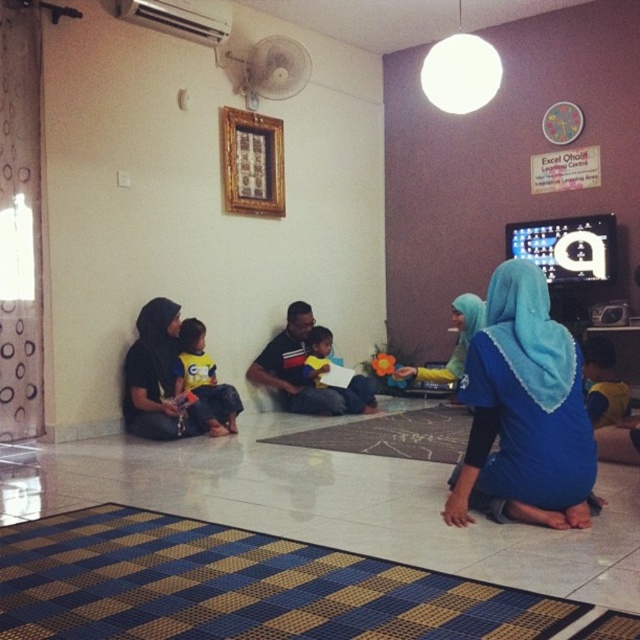
Does matte black hijab at left lie behind white textured mat at center?

Yes.

Can you confirm if matte black hijab at left is positioned to the right of white textured mat at center?

Incorrect, matte black hijab at left is not on the right side of white textured mat at center.

The height and width of the screenshot is (640, 640). What do you see at coordinates (161, 380) in the screenshot? I see `matte black hijab at left` at bounding box center [161, 380].

In order to click on matte black hijab at left in this screenshot , I will do `click(161, 380)`.

Is point (355, 435) positioned before point (180, 358)?

Yes.

Is point (298, 438) closer to camera compared to point (182, 321)?

Yes, point (298, 438) is closer to viewer.

Where is `white textured mat at center`? The height and width of the screenshot is (640, 640). white textured mat at center is located at coordinates (392, 435).

Is white textured mat at center to the left of yellow fabric shirt at center from the viewer's perspective?

Incorrect, white textured mat at center is not on the left side of yellow fabric shirt at center.

Measure the distance between white textured mat at center and yellow fabric shirt at center.

A distance of 29.07 inches exists between white textured mat at center and yellow fabric shirt at center.

Identify the location of white textured mat at center. Image resolution: width=640 pixels, height=640 pixels. (392, 435).

I want to click on white textured mat at center, so click(x=392, y=435).